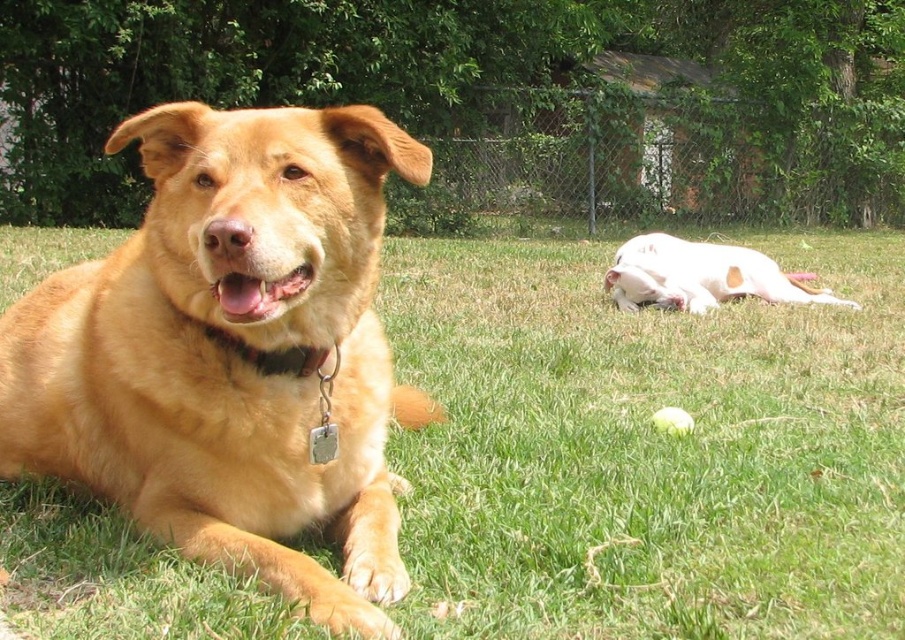
Question: Which of the following is the farthest from the observer?

Choices:
 (A) green grass at center
 (B) white smooth dog at right
 (C) brown leather collar at center
 (D) golden fur dog at center

Answer: (B)

Question: Which point is closer to the camera taking this photo?

Choices:
 (A) (18, 323)
 (B) (710, 244)
 (C) (618, 422)
 (D) (294, 355)

Answer: (D)

Question: Is green grass at center below white smooth dog at right?

Choices:
 (A) yes
 (B) no

Answer: (A)

Question: Among these points, which one is farthest from the camera?

Choices:
 (A) (246, 504)
 (B) (25, 611)
 (C) (639, 241)
 (D) (260, 349)

Answer: (C)

Question: Can you confirm if white smooth dog at right is thinner than brown leather collar at center?

Choices:
 (A) no
 (B) yes

Answer: (A)

Question: Where is green grass at center located in relation to white smooth dog at right in the image?

Choices:
 (A) below
 (B) above

Answer: (A)